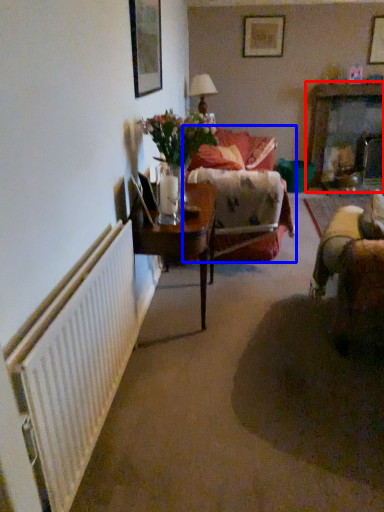
Question: Which point is closer to the camera, dresser (highlighted by a red box) or studio couch (highlighted by a blue box)?

Choices:
 (A) dresser
 (B) studio couch

Answer: (B)